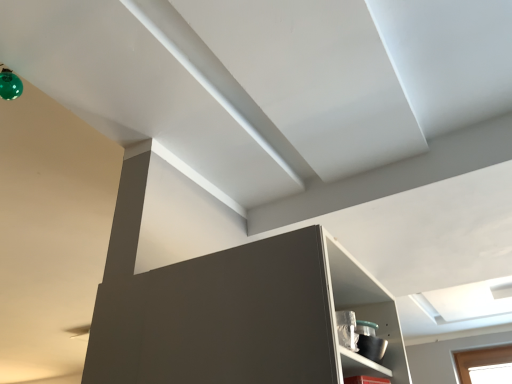
This screenshot has height=384, width=512. What do you see at coordinates (387, 336) in the screenshot? I see `metallic silver bowl at upper right` at bounding box center [387, 336].

Where is `metallic silver bowl at upper right`? metallic silver bowl at upper right is located at coordinates pos(387,336).

Find the location of a particular element. metallic silver bowl at upper right is located at coordinates (387, 336).